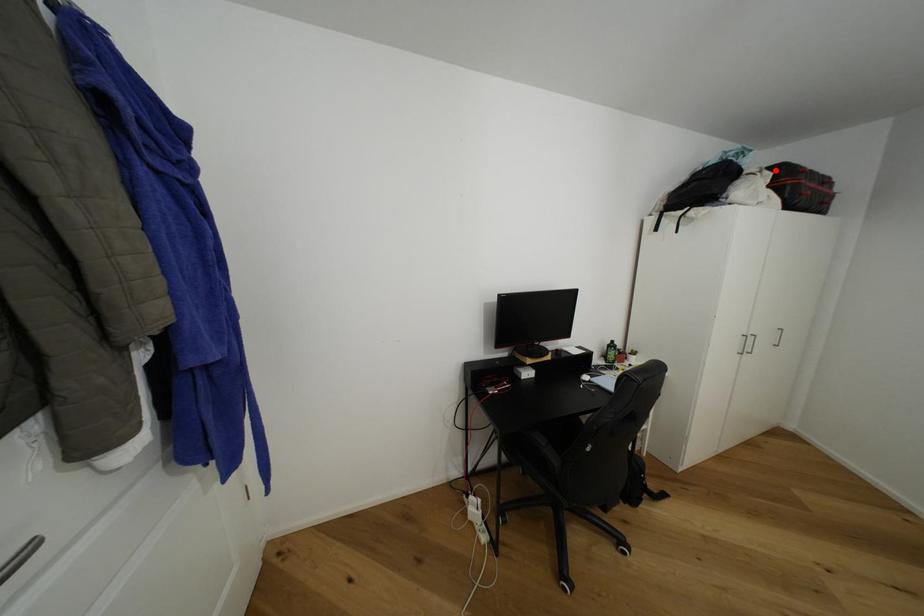
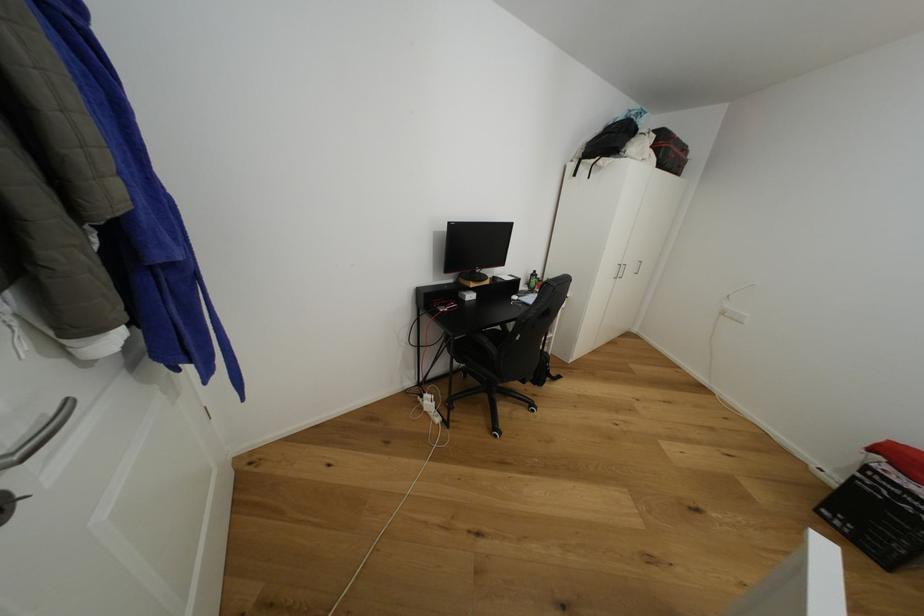
Locate, in the second image, the point that corresponds to the highlighted location in the first image.

(660, 132)